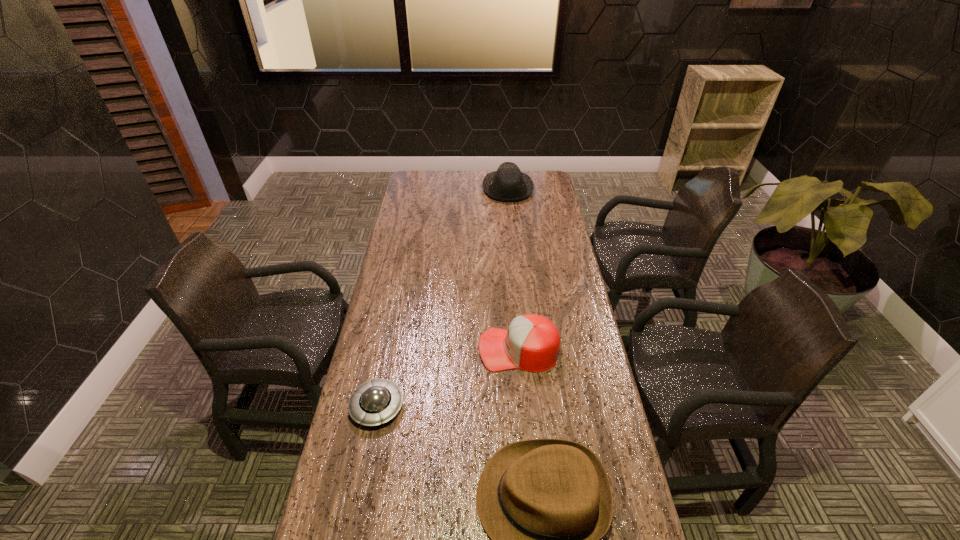
This screenshot has width=960, height=540. I want to click on vacant space situated on the right of the shortest object, so click(x=459, y=407).

Find the location of a particular element. The width and height of the screenshot is (960, 540). object located in the far edge section of the desktop is located at coordinates (508, 184).

The image size is (960, 540). I want to click on object that is at the left edge, so click(375, 402).

At what (x,y) coordinates should I click in order to perform the action: click on fedora that is at the right edge. Please return your answer as a coordinate pair (x, y). The image size is (960, 540). Looking at the image, I should click on click(x=508, y=184).

I want to click on baseball cap located at the right edge, so click(532, 342).

Where is `object at the far right corner`? This screenshot has height=540, width=960. object at the far right corner is located at coordinates (508, 184).

This screenshot has width=960, height=540. What are the coordinates of `blank area at the left edge` in the screenshot? It's located at (427, 230).

Find the location of a particular element. vacant space at the right edge of the desktop is located at coordinates (585, 346).

I want to click on vacant region at the far left corner, so click(x=436, y=172).

The height and width of the screenshot is (540, 960). Find the location of `vacant space in between the third nearest object and the shortest object`. vacant space in between the third nearest object and the shortest object is located at coordinates (447, 378).